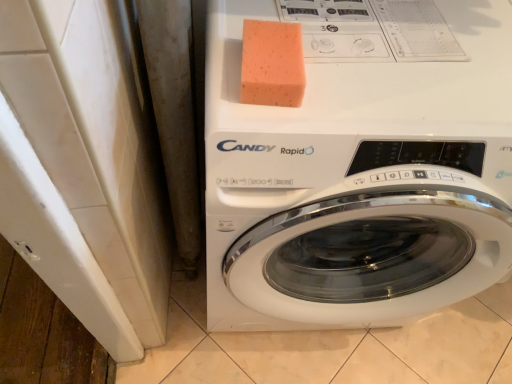
Question: Is white glossy washing machine at center surrounding orange sponge at upper center?

Choices:
 (A) no
 (B) yes

Answer: (B)

Question: From the image's perspective, is white glossy washing machine at center under orange sponge at upper center?

Choices:
 (A) yes
 (B) no

Answer: (A)

Question: Can you confirm if white glossy washing machine at center is taller than orange sponge at upper center?

Choices:
 (A) no
 (B) yes

Answer: (B)

Question: Is white glossy washing machine at center far from orange sponge at upper center?

Choices:
 (A) no
 (B) yes

Answer: (A)

Question: Is white glossy washing machine at center facing towards orange sponge at upper center?

Choices:
 (A) no
 (B) yes

Answer: (A)

Question: Is white glossy washing machine at center oriented away from orange sponge at upper center?

Choices:
 (A) no
 (B) yes

Answer: (A)

Question: Does orange sponge at upper center have a greater width compared to white glossy washing machine at center?

Choices:
 (A) yes
 (B) no

Answer: (B)

Question: Could you tell me if orange sponge at upper center is turned towards white glossy washing machine at center?

Choices:
 (A) no
 (B) yes

Answer: (A)

Question: From a real-world perspective, is orange sponge at upper center on white glossy washing machine at center?

Choices:
 (A) no
 (B) yes

Answer: (B)

Question: Is orange sponge at upper center turned away from white glossy washing machine at center?

Choices:
 (A) no
 (B) yes

Answer: (A)

Question: From the image's perspective, would you say orange sponge at upper center is positioned over white glossy washing machine at center?

Choices:
 (A) no
 (B) yes

Answer: (B)

Question: Does orange sponge at upper center have a smaller size compared to white glossy washing machine at center?

Choices:
 (A) no
 (B) yes

Answer: (B)

Question: From the image's perspective, is white glossy washing machine at center located above or below orange sponge at upper center?

Choices:
 (A) above
 (B) below

Answer: (B)